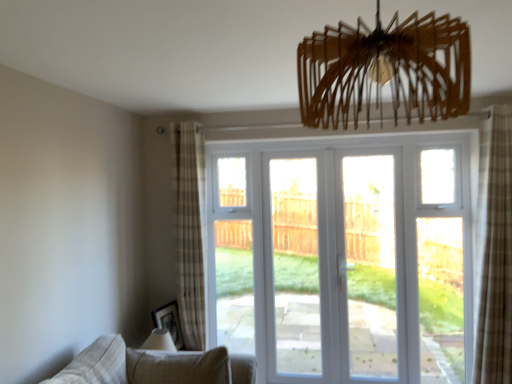
Question: Is beige fabric couch at lower left looking in the opposite direction of matte black picture frame at lower left?

Choices:
 (A) no
 (B) yes

Answer: (B)

Question: Is beige fabric couch at lower left smaller than matte black picture frame at lower left?

Choices:
 (A) yes
 (B) no

Answer: (B)

Question: Can matte black picture frame at lower left be found inside beige fabric couch at lower left?

Choices:
 (A) no
 (B) yes

Answer: (A)

Question: Does beige fabric couch at lower left have a greater width compared to matte black picture frame at lower left?

Choices:
 (A) yes
 (B) no

Answer: (A)

Question: Can you confirm if beige fabric couch at lower left is shorter than matte black picture frame at lower left?

Choices:
 (A) yes
 (B) no

Answer: (A)

Question: From a real-world perspective, relative to plaid fabric curtain at left, the 1th curtain viewed from the back, is white glossy door at center vertically above or below?

Choices:
 (A) below
 (B) above

Answer: (A)

Question: Do you think white glossy door at center is within plaid fabric curtain at left, the 2th curtain positioned from the front, or outside of it?

Choices:
 (A) outside
 (B) inside

Answer: (A)

Question: From the image's perspective, is white glossy door at center positioned above or below plaid fabric curtain at left, the 2th curtain positioned from the front?

Choices:
 (A) below
 (B) above

Answer: (A)

Question: Considering the positions of white glossy door at center and plaid fabric curtain at left, which is the first curtain in left-to-right order, in the image, is white glossy door at center taller or shorter than plaid fabric curtain at left, which is the first curtain in left-to-right order,?

Choices:
 (A) short
 (B) tall

Answer: (A)

Question: From the image's perspective, is white glass door at center, the 2th screen door viewed from the right, above or below beige fabric couch at lower left?

Choices:
 (A) above
 (B) below

Answer: (A)

Question: In terms of height, does white glass door at center, the 2th screen door viewed from the right, look taller or shorter compared to beige fabric couch at lower left?

Choices:
 (A) short
 (B) tall

Answer: (B)

Question: In terms of size, does white glass door at center, the first screen door positioned from the left, appear bigger or smaller than beige fabric couch at lower left?

Choices:
 (A) big
 (B) small

Answer: (A)

Question: From a real-world perspective, relative to beige fabric couch at lower left, is white glass door at center, the 2th screen door viewed from the right, vertically above or below?

Choices:
 (A) below
 (B) above

Answer: (B)

Question: Is white glossy door at center, which is the second screen door in left-to-right order, taller or shorter than wooden chandelier at upper center?

Choices:
 (A) short
 (B) tall

Answer: (B)

Question: Looking at their shapes, would you say white glossy door at center, the first screen door from the right, is wider or thinner than wooden chandelier at upper center?

Choices:
 (A) thin
 (B) wide

Answer: (A)